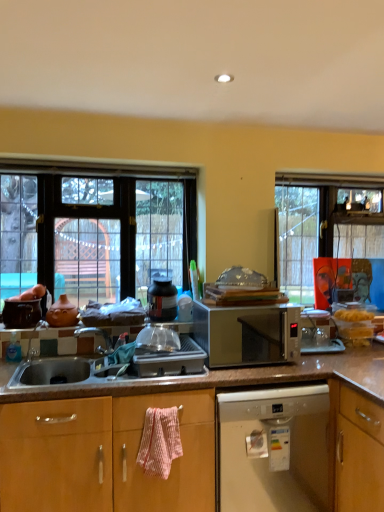
Question: Does point (18, 183) appear closer or farther from the camera than point (241, 441)?

Choices:
 (A) farther
 (B) closer

Answer: (A)

Question: Considering the positions of clear glass window at left and white plastic dishwasher at lower center in the image, is clear glass window at left taller or shorter than white plastic dishwasher at lower center?

Choices:
 (A) short
 (B) tall

Answer: (B)

Question: Which of these objects is positioned closest to the silver metallic microwave at center?

Choices:
 (A) clear glass window at left
 (B) pink textured towel at lower center
 (C) matte black pot at center
 (D) white plastic dishwasher at lower center

Answer: (D)

Question: Which object is the closest to the silver metallic microwave at center?

Choices:
 (A) pink textured towel at lower center
 (B) clear glass window at left
 (C) matte black pot at center
 (D) white plastic dishwasher at lower center

Answer: (D)